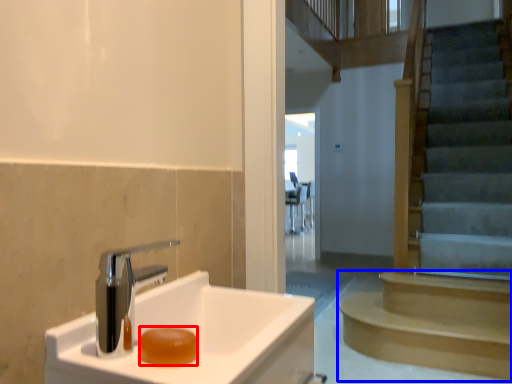
Question: Which point is closer to the camera, soap (highlighted by a red box) or stairs (highlighted by a blue box)?

Choices:
 (A) soap
 (B) stairs

Answer: (A)